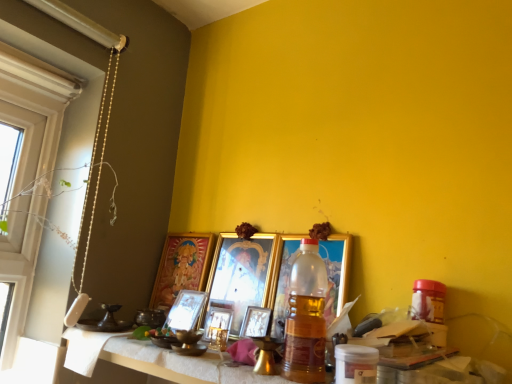
Question: Do you think metallic gold picture frame at center, the 2th picture frame when ordered from right to left, is within metallic gold picture frame at center, which is counted as the 4th picture frame, starting from the right, or outside of it?

Choices:
 (A) inside
 (B) outside

Answer: (B)

Question: From a real-world perspective, relative to metallic gold picture frame at center, which is counted as the 4th picture frame, starting from the right, is metallic gold picture frame at center, arranged as the 5th picture frame when viewed from the left, vertically above or below?

Choices:
 (A) above
 (B) below

Answer: (A)

Question: Which is farther from the metallic silver picture frame at center, which is the fifth picture frame in right-to-left order?

Choices:
 (A) metallic gold picture frame at center, the 2th picture frame when ordered from right to left
 (B) gold-framed picture at center, acting as the sixth picture frame starting from the right
 (C) translucent plastic bottle at center
 (D) gold metallic picture frame at center, placed as the first picture frame when sorted from right to left
 (E) metallic gold picture frame at center, which is counted as the 4th picture frame, starting from the right

Answer: (C)

Question: Which object is the farthest from the translucent plastic bottle at center?

Choices:
 (A) metallic gold picture frame at center, arranged as the 5th picture frame when viewed from the left
 (B) gold-framed picture at center, the 1th picture frame when ordered from left to right
 (C) gold metallic picture frame at center, the third picture frame viewed from the right
 (D) gold metallic picture frame at center, placed as the first picture frame when sorted from right to left
 (E) metallic gold picture frame at center, which is counted as the 4th picture frame, starting from the right

Answer: (B)